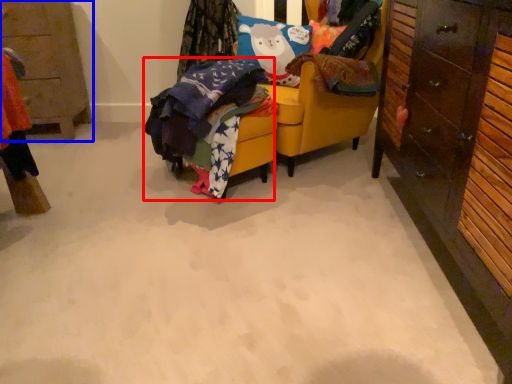
Question: Among these objects, which one is farthest to the camera, clothing (highlighted by a red box) or cabinetry (highlighted by a blue box)?

Choices:
 (A) clothing
 (B) cabinetry

Answer: (B)